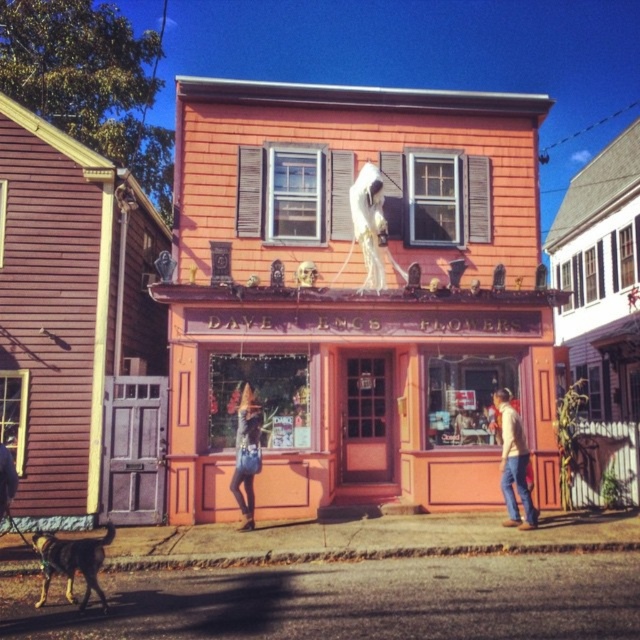
You are standing in front of the matte pink building at center and want to reach the light brown leather jacket at lower right. Which direction should you move in to get closer to the jacket?

You should move downward towards the light brown leather jacket at lower right because the matte pink building at center is located above it.